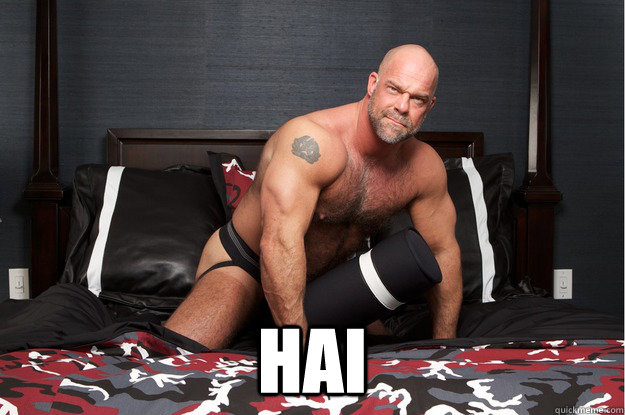
At what (x,y) coordinates should I click in order to perform the action: click on bedding. Please return your answer as a coordinate pair (x, y). Image resolution: width=625 pixels, height=415 pixels. Looking at the image, I should click on (457, 389).